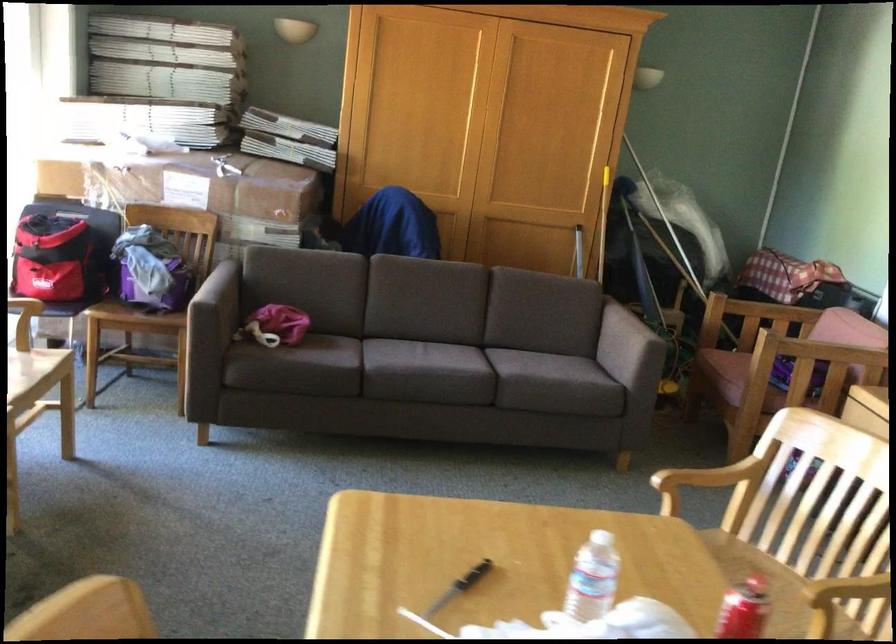
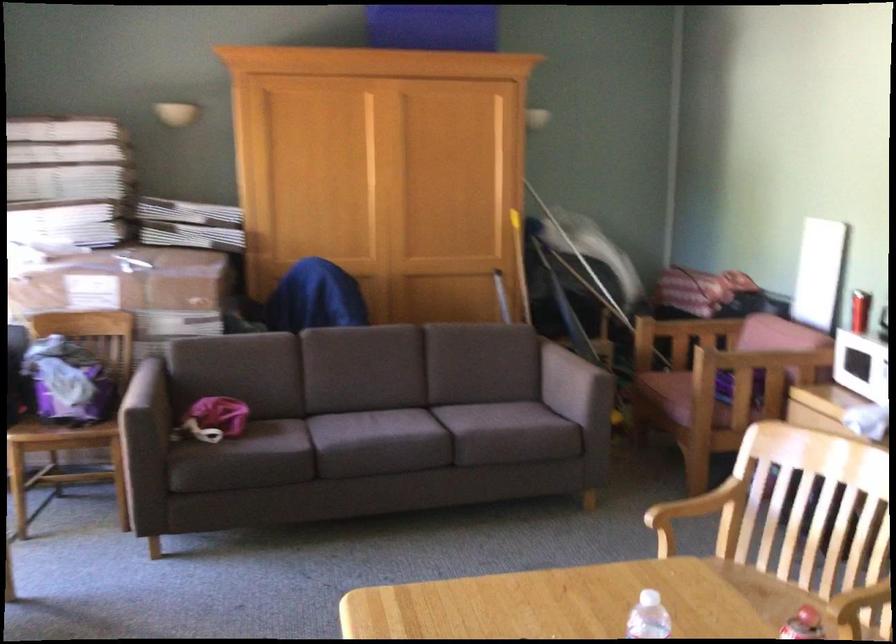
Where in the second image is the point corresponding to (x=631, y=346) from the first image?

(574, 386)